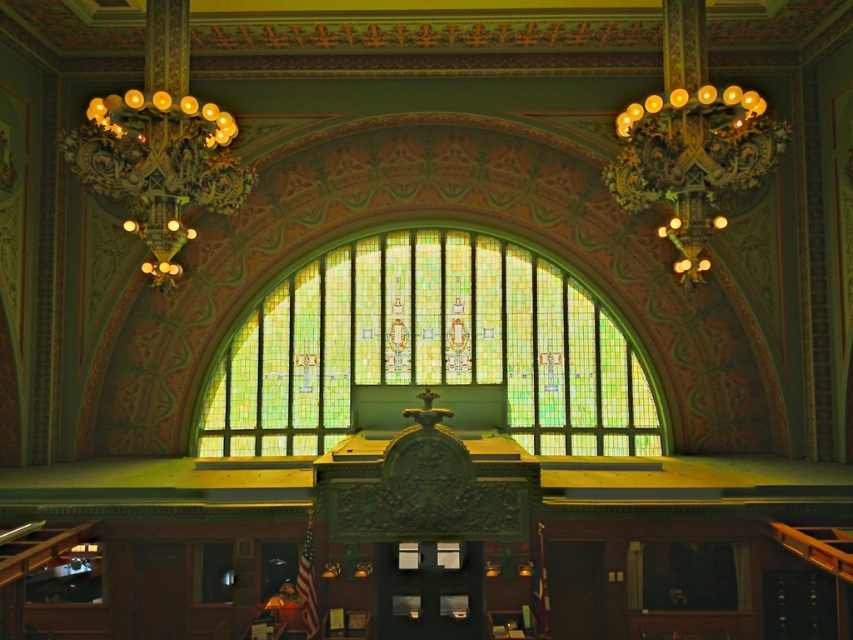
Who is taller, stained glass window at center or gold metallic chandelier at upper left?

With more height is stained glass window at center.

Can you confirm if stained glass window at center is smaller than gold metallic chandelier at upper left?

Yes, stained glass window at center is smaller than gold metallic chandelier at upper left.

The height and width of the screenshot is (640, 853). Describe the element at coordinates (428, 348) in the screenshot. I see `stained glass window at center` at that location.

What are the coordinates of `stained glass window at center` in the screenshot? It's located at (428, 348).

Does gold metallic chandelier at upper left have a greater width compared to gold metallic chandelier at upper right?

Indeed, gold metallic chandelier at upper left has a greater width compared to gold metallic chandelier at upper right.

Where is `gold metallic chandelier at upper left`? Image resolution: width=853 pixels, height=640 pixels. gold metallic chandelier at upper left is located at coordinates (158, 164).

The image size is (853, 640). Find the location of `gold metallic chandelier at upper left`. gold metallic chandelier at upper left is located at coordinates (158, 164).

Is point (560, 317) in front of point (637, 198)?

No, it is behind (637, 198).

Between stained glass window at center and gold metallic chandelier at upper right, which one has less height?

gold metallic chandelier at upper right is shorter.

Does point (387, 276) lie behind point (709, 198)?

Yes, point (387, 276) is farther from viewer.

The height and width of the screenshot is (640, 853). I want to click on stained glass window at center, so click(428, 348).